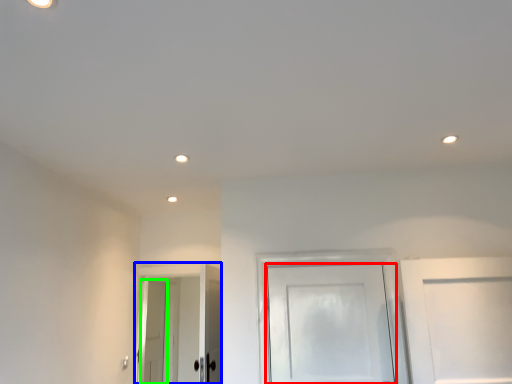
Question: Which object is the closest to the door (highlighted by a red box)? Choose among these: door (highlighted by a blue box) or door (highlighted by a green box).

Choices:
 (A) door
 (B) door

Answer: (A)